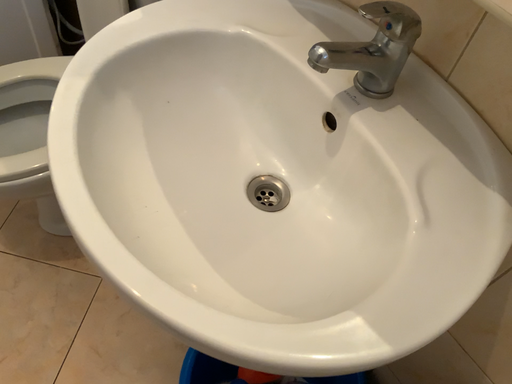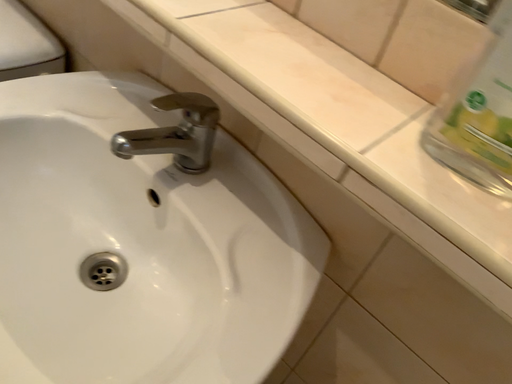
Question: Which way did the camera rotate in the video?

Choices:
 (A) rotated left
 (B) rotated right

Answer: (B)